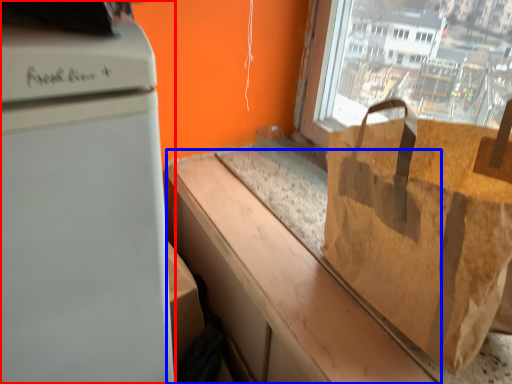
Question: Which point is further to the camera, home appliance (highlighted by a red box) or counter top (highlighted by a blue box)?

Choices:
 (A) home appliance
 (B) counter top

Answer: (B)